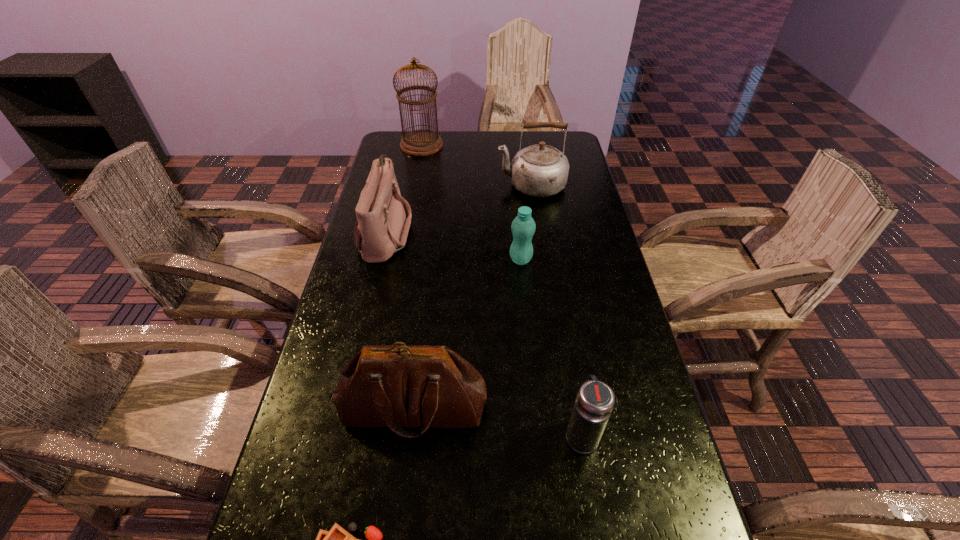
The image size is (960, 540). I want to click on thermos bottle present at the right edge, so click(595, 400).

This screenshot has width=960, height=540. What are the coordinates of `object located at the far left corner` in the screenshot? It's located at (422, 142).

In the image, there is a desktop. At what (x,y) coordinates should I click in order to perform the action: click on free space at the far edge. Please return your answer as a coordinate pair (x, y). The height and width of the screenshot is (540, 960). Looking at the image, I should click on (467, 136).

In the image, there is a desktop. Where is `vacant space at the left edge`? This screenshot has width=960, height=540. vacant space at the left edge is located at coordinates (408, 170).

You are a GUI agent. You are given a task and a screenshot of the screen. Output one action in this format:
    pyautogui.click(x=<x>, y=<y>)
    Task: Click on the vacant space at the right edge of the desktop
    The height and width of the screenshot is (540, 960).
    Given the screenshot: What is the action you would take?
    pyautogui.click(x=568, y=196)

You are a GUI agent. You are given a task and a screenshot of the screen. Output one action in this format:
    pyautogui.click(x=<x>, y=<y>)
    Task: Click on the free space at the far left corner of the desktop
    
    Given the screenshot: What is the action you would take?
    pyautogui.click(x=411, y=159)

Find the location of a particular element. The image size is (960, 540). free space at the far right corner of the desktop is located at coordinates (549, 133).

At what (x,y) coordinates should I click in order to perform the action: click on empty space between the nearer shoulder bag and the shorter shoulder bag. Please return your answer as a coordinate pair (x, y). The image size is (960, 540). Looking at the image, I should click on (399, 320).

Image resolution: width=960 pixels, height=540 pixels. I want to click on vacant space that is in between the nearer shoulder bag and the farther shoulder bag, so click(399, 320).

The image size is (960, 540). I want to click on free space between the tallest object and the farther shoulder bag, so click(x=404, y=188).